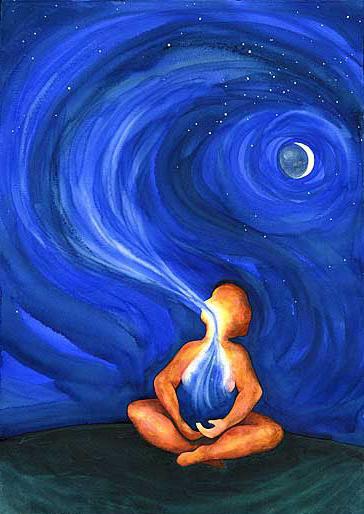
Locate an element on the screen. floor is located at coordinates (125, 481).